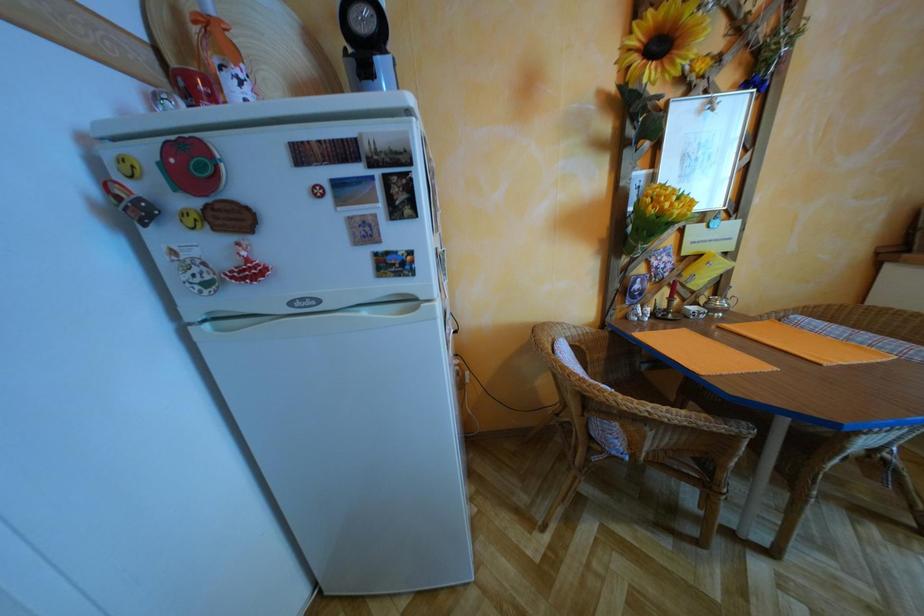
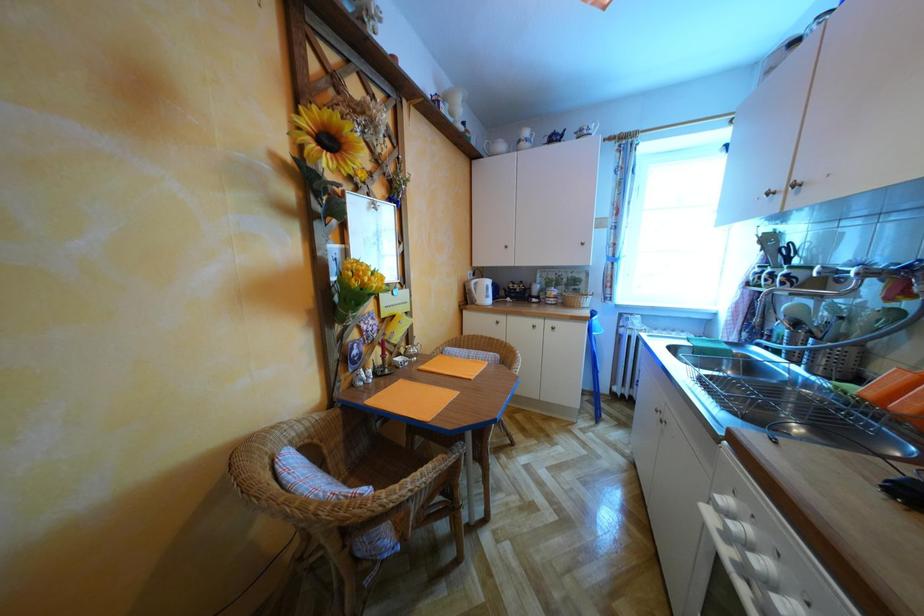
Question: The camera is either moving clockwise (left) or counter-clockwise (right) around the object. The first image is from the beginning of the video and the second image is from the end. Is the camera moving left or right when shooting the video?

Choices:
 (A) Left
 (B) Right

Answer: (A)